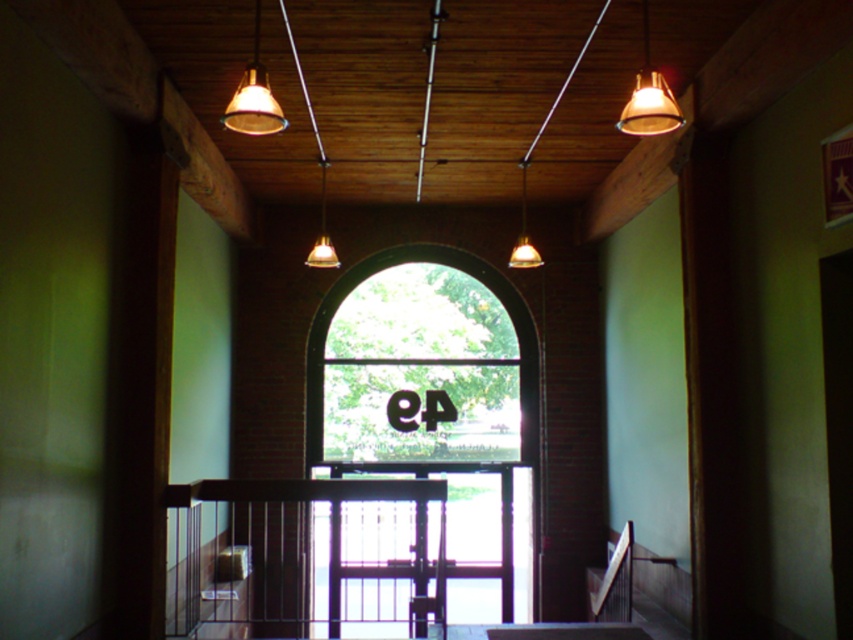
Question: Is matte gold pendant light at center positioned before matte glass pendant light at center?

Choices:
 (A) no
 (B) yes

Answer: (A)

Question: Can you confirm if matte glass light at upper center is thinner than matte glass pendant light at center?

Choices:
 (A) no
 (B) yes

Answer: (A)

Question: Considering the real-world distances, which object is closest to the matte gold pendant light at center?

Choices:
 (A) matte glass lamp at upper left
 (B) matte glass pendant light at center

Answer: (B)

Question: Which is farther from the transparent glass window at center?

Choices:
 (A) matte gold pendant light at center
 (B) matte glass light at upper center
 (C) black metal balustrade at lower center
 (D) matte gold pendant light at upper right

Answer: (B)

Question: Which object appears closest to the camera in this image?

Choices:
 (A) matte gold pendant light at upper right
 (B) black metal balustrade at lower center

Answer: (A)

Question: Can you confirm if matte glass lamp at upper left is smaller than matte gold pendant light at center?

Choices:
 (A) yes
 (B) no

Answer: (B)